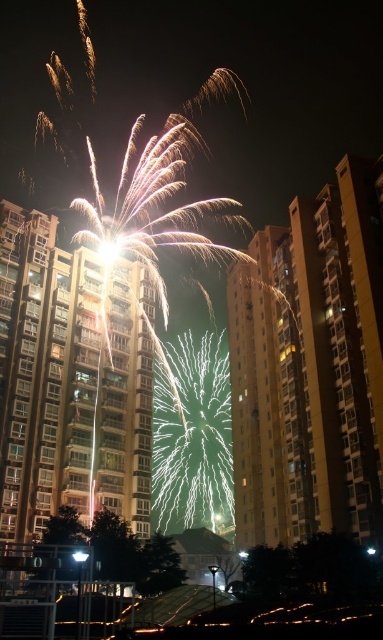
Does bright white sparkler at center appear under white glass streetlight at center?

No, bright white sparkler at center is not below white glass streetlight at center.

Based on the photo, measure the distance between point (x=103, y=250) and camera.

They are 295.41 feet apart.

Where is `bright white sparkler at center`? bright white sparkler at center is located at coordinates (109, 250).